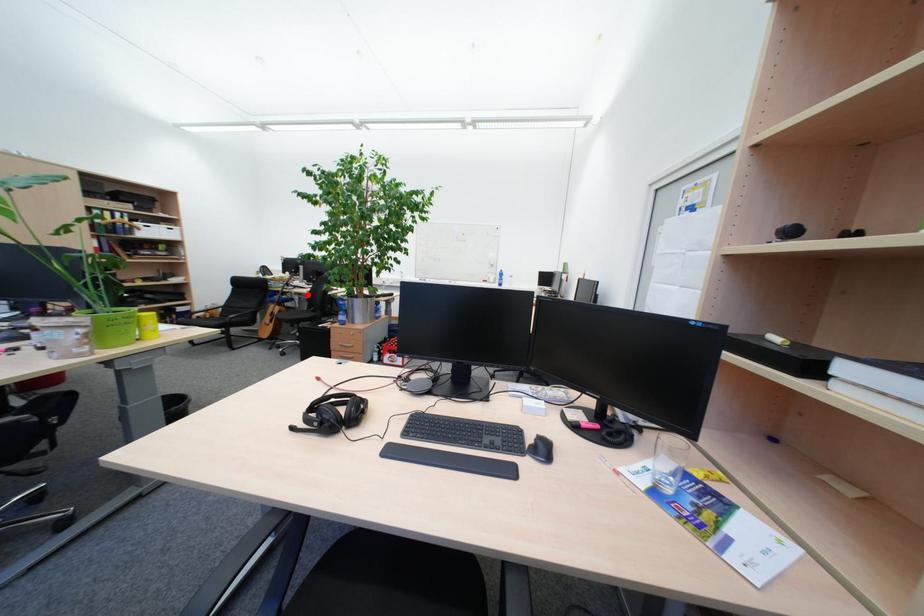
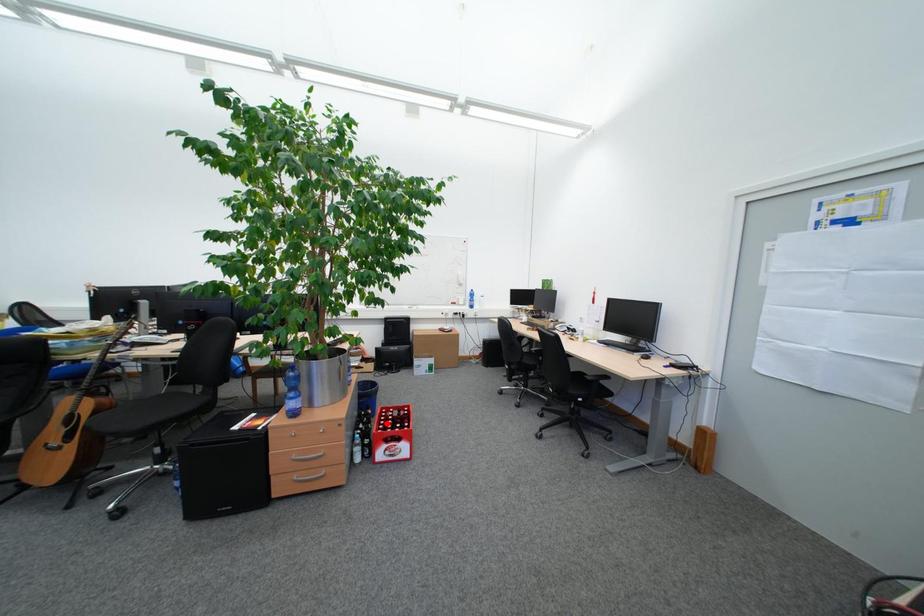
I am providing you with two images of the same scene from different viewpoints. A red point is marked on the first image and another point is marked on the second image. Are the points marked in image1 and image2 representing the same 3D position?

No